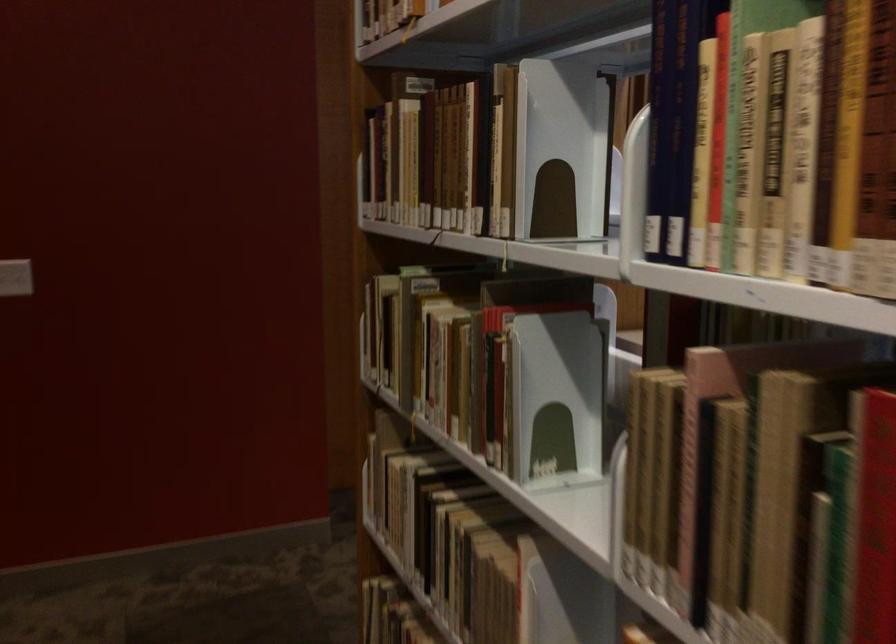
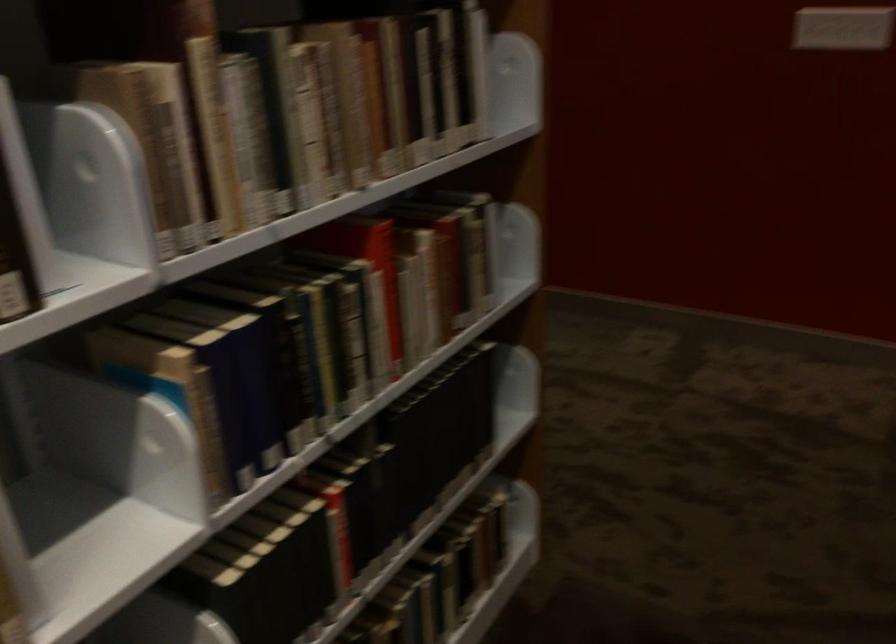
The first image is from the beginning of the video and the second image is from the end. How did the camera likely rotate when shooting the video?

The camera's rotation is toward left-down.